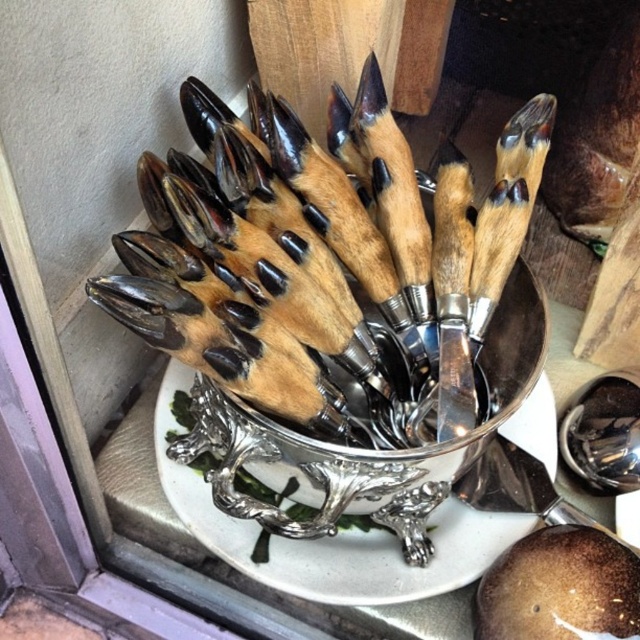
You are arranging items on a table and need to place a decorative item to the left of the silver metallic bowl at center. Based on the scene description, where should you position the new item?

The silver metallic bowl at center is located at point (365, 449), so to place an item to its left, you should position it at a coordinate with a lower x value than 0.703 while maintaining the same y value of 0.572.

You are setting up a table for a formal dinner and need to place both the silver metallic bowl at center and the polished silver spoon at center. Given their sizes, which one should you place first to ensure stability?

The silver metallic bowl at center is much taller than the polished silver spoon at center, so you should place the silver metallic bowl at center first to provide a stable base for the spoon.

You are arranging utensils on a table and need to place the silver metallic bowl at center and the polished silver spoon at center. Based on the image, which object is positioned closer to you?

The silver metallic bowl at center is closer to the viewer than the polished silver spoon at center.